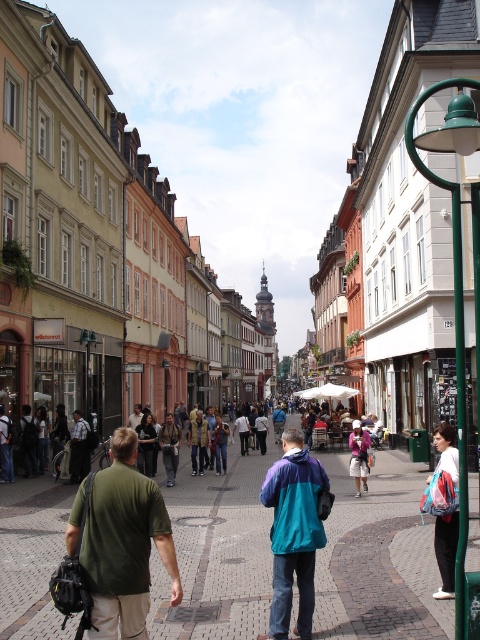
Is white cotton hoodie at lower right positioned at the back of denim jacket at center?

No, it is in front of denim jacket at center.

Measure the distance between point (450, 548) and camera.

They are 109.02 feet apart.

Identify the location of white cotton hoodie at lower right. (445, 552).

Does brick paved at center have a greater height compared to khaki cotton pants at center?

No, brick paved at center is not taller than khaki cotton pants at center.

In the scene shown: Can you confirm if brick paved at center is positioned to the left of khaki cotton pants at center?

No, brick paved at center is not to the left of khaki cotton pants at center.

This screenshot has width=480, height=640. Describe the element at coordinates (379, 556) in the screenshot. I see `brick paved at center` at that location.

You are a GUI agent. You are given a task and a screenshot of the screen. Output one action in this format:
    pyautogui.click(x=<x>, y=<y>)
    Task: Click on the brick paved at center
    This screenshot has height=640, width=480.
    Given the screenshot: What is the action you would take?
    pyautogui.click(x=379, y=556)

Can you confirm if brick paved at center is smaller than green fabric shirt at center?

No.

Which is in front, point (431, 550) or point (95, 576)?

Point (95, 576) is more forward.

Who is more forward, (384, 611) or (155, 504)?

Positioned in front is point (155, 504).

Identify the location of brick paved at center. (379, 556).